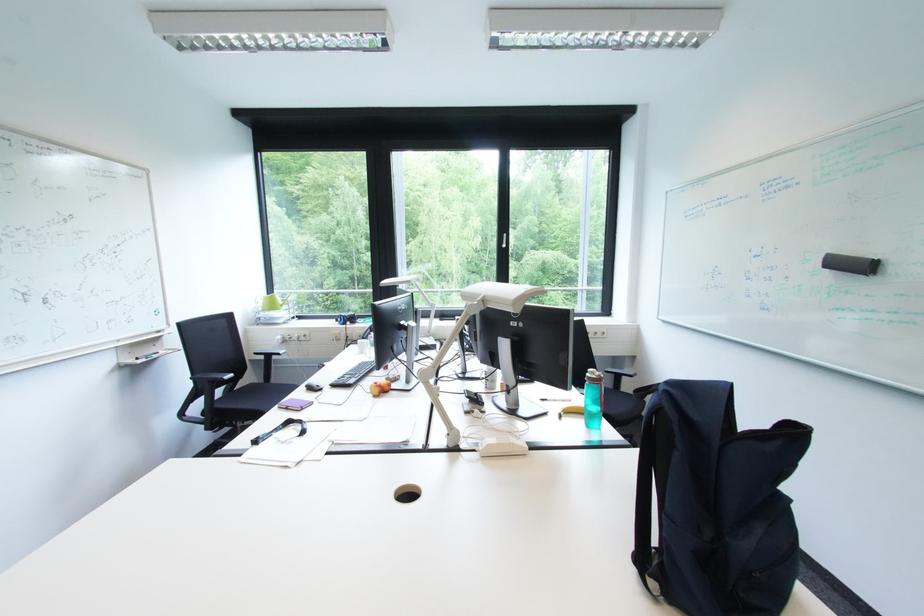
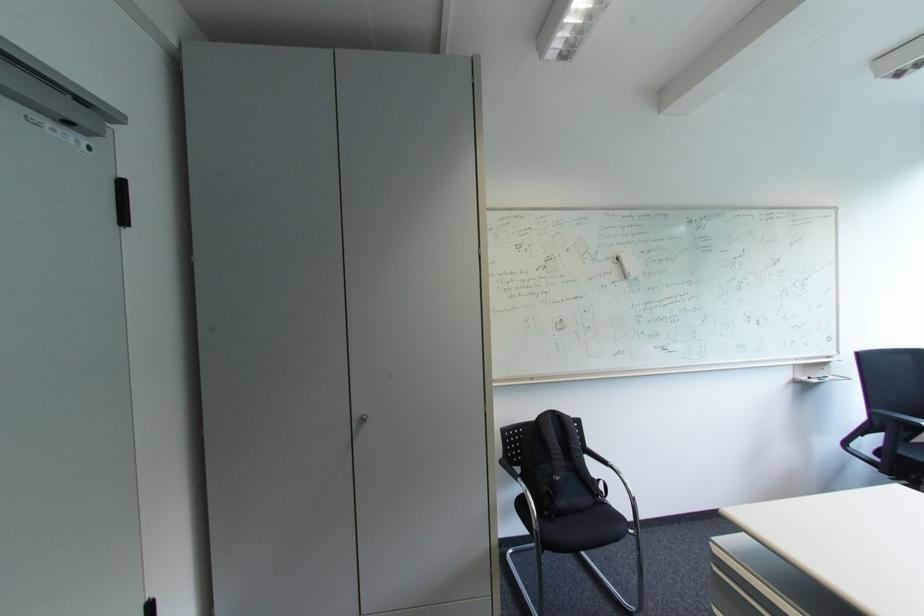
Locate, in the second image, the point that corresponds to point 148,361 in the first image.

(819, 379)